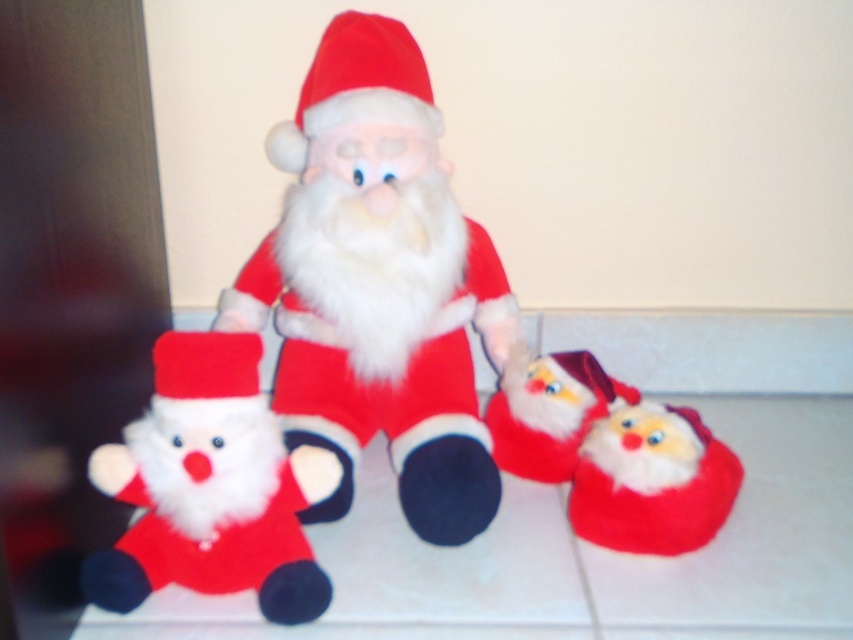
Which is more to the left, velvety red santa at center or fuzzy fabric santa at center?

velvety red santa at center

Which is in front, point (271, 241) or point (520, 403)?

Point (520, 403) is more forward.

Is point (477, 532) farther from camera compared to point (602, 381)?

No, (477, 532) is in front of (602, 381).

What are the coordinates of `velvety red santa at center` in the screenshot? It's located at (378, 284).

Between point (173, 429) and point (691, 468), which one is positioned in front?

Point (173, 429) is more forward.

Does velvety red santa at left have a greater height compared to fuzzy red santa hat at lower right?

Yes.

Who is more forward, (x=198, y=577) or (x=672, y=548)?

Point (x=198, y=577) is in front.

Image resolution: width=853 pixels, height=640 pixels. Find the location of `velvety red santa at left`. velvety red santa at left is located at coordinates (212, 486).

Between fuzzy fabric santa at center and matte fabric santa hat at center, which one has less height?

Standing shorter between the two is matte fabric santa hat at center.

In order to click on fuzzy fabric santa at center in this screenshot , I will do click(548, 412).